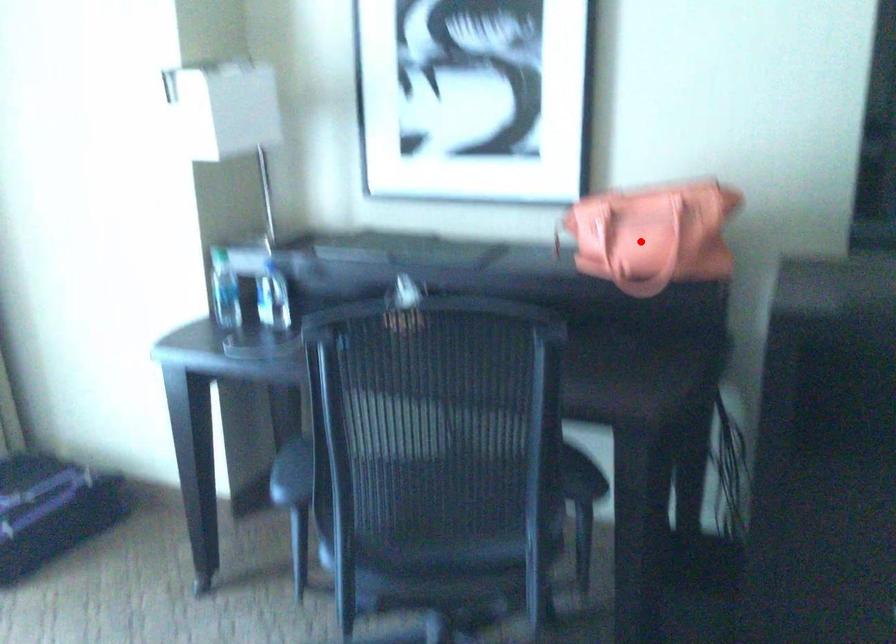
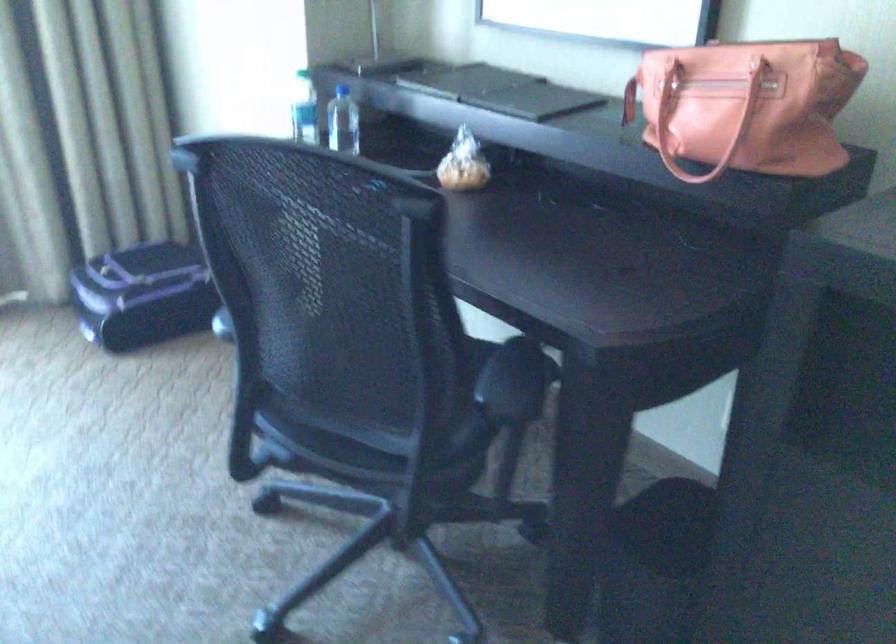
Question: I am providing you with two images of the same scene from different viewpoints. Given a red point in image1, look at the same physical point in image2. Is it:

Choices:
 (A) Closer to the viewpoint
 (B) Farther from the viewpoint

Answer: (A)